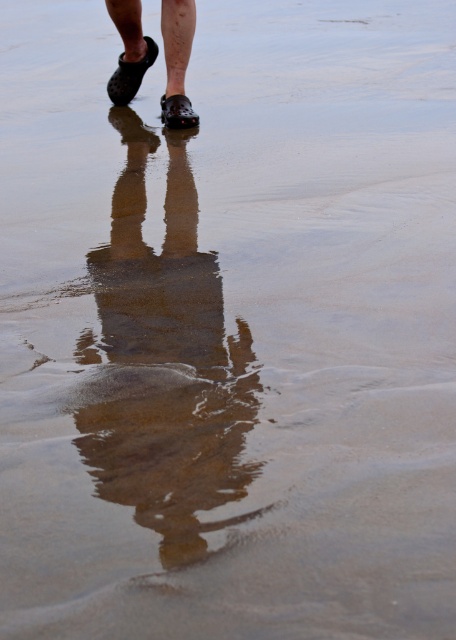
Measure the distance between point (x=182, y=65) and camera.

They are 18.55 feet apart.

Is black rubber shoes at upper center shorter than matte black shoe at center?

No, black rubber shoes at upper center is not shorter than matte black shoe at center.

What do you see at coordinates (176, 61) in the screenshot?
I see `black rubber shoes at upper center` at bounding box center [176, 61].

Find the location of `black rubber shoes at upper center`. black rubber shoes at upper center is located at coordinates (176, 61).

Identify the location of black rubber sandal at upper center. The image size is (456, 640). (129, 74).

In the scene shown: Who is more distant from viewer, (x=148, y=36) or (x=170, y=120)?

Point (x=148, y=36)

The width and height of the screenshot is (456, 640). I want to click on black rubber sandal at upper center, so click(129, 74).

Is black rubber shoes at upper center below black rubber sandal at upper center?

Yes.

Can you confirm if black rubber shoes at upper center is positioned to the left of black rubber sandal at upper center?

Incorrect, black rubber shoes at upper center is not on the left side of black rubber sandal at upper center.

Which is behind, point (119, 13) or point (129, 99)?

Positioned behind is point (129, 99).

The image size is (456, 640). Find the location of `black rubber shoes at upper center`. black rubber shoes at upper center is located at coordinates (176, 61).